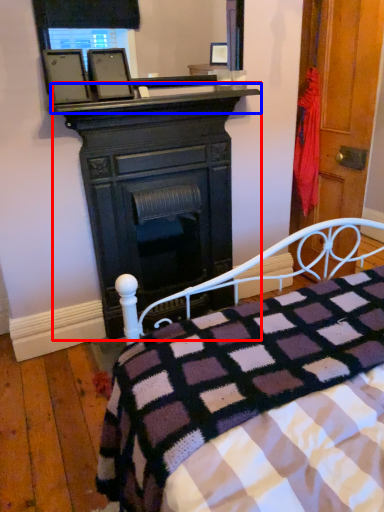
Question: Which object is further to the camera taking this photo, desk (highlighted by a red box) or mantle (highlighted by a blue box)?

Choices:
 (A) desk
 (B) mantle

Answer: (A)